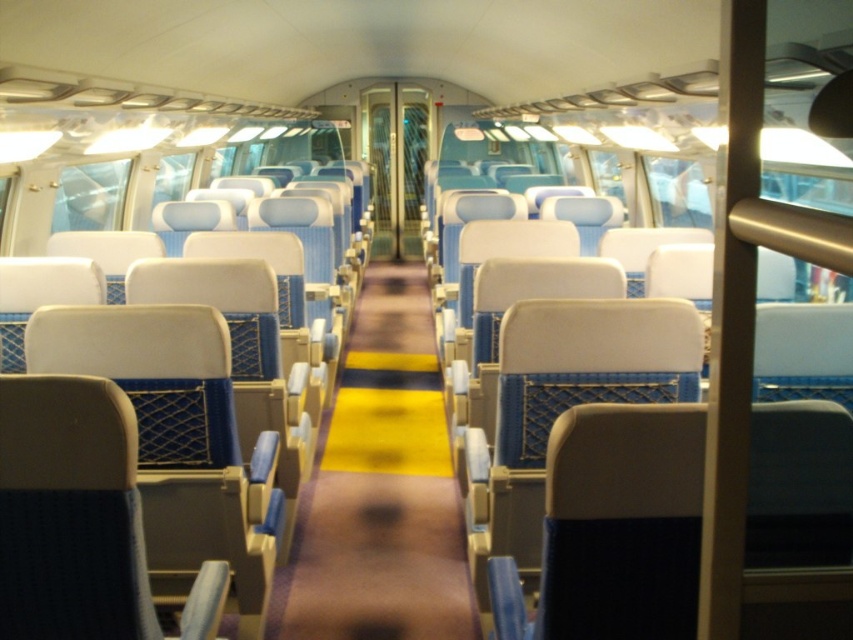
Does beige fabric chair at center appear over blue fabric seat at center?

Actually, beige fabric chair at center is below blue fabric seat at center.

Where is `beige fabric chair at center`? The image size is (853, 640). beige fabric chair at center is located at coordinates (564, 404).

Where is `beige fabric chair at center`? beige fabric chair at center is located at coordinates (564, 404).

Does point (181, 451) come farther from viewer compared to point (524, 362)?

That is True.

Who is more forward, (178, 316) or (517, 458)?

Point (178, 316) is in front.

I want to click on matte blue seat at center, so click(178, 436).

Can you confirm if blue fabric aisle at center is bigger than beige fabric chair at center?

No, blue fabric aisle at center is not bigger than beige fabric chair at center.

Which is more to the right, blue fabric aisle at center or beige fabric chair at center?

beige fabric chair at center

Image resolution: width=853 pixels, height=640 pixels. I want to click on blue fabric aisle at center, so click(380, 490).

In order to click on blue fabric aisle at center in this screenshot , I will do click(380, 490).